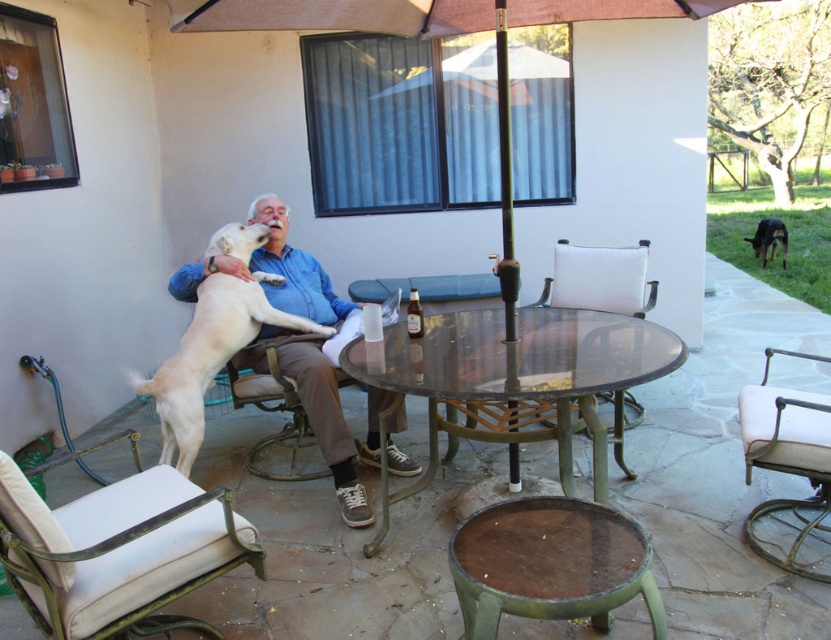
You are a guest at this patio and want to place a small plate on the transparent glass table at center without blocking the view of the light blue shirt at center. Is this possible?

The transparent glass table at center is in front of the light blue shirt at center, so placing a small plate on the table won t block the view of the light blue shirt at center as the table is transparent and positioned in front.

You are standing on the patio and want to sit in the white fabric chair at lower left. Which direction should you walk from your current position at point (117,552) to reach it?

The point (117,552) corresponds to the white fabric chair at lower left, so you are already sitting there.